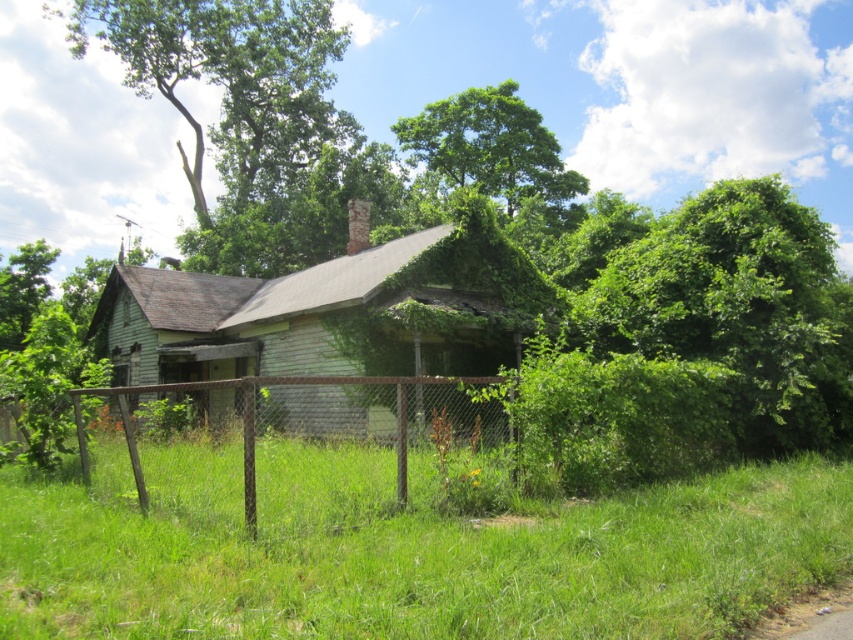
Question: Can you confirm if green grass at lower center is positioned to the left of green leafy tree at upper right?

Choices:
 (A) yes
 (B) no

Answer: (A)

Question: Is green leafy tree at upper center thinner than rusty chain-link fence at lower center?

Choices:
 (A) yes
 (B) no

Answer: (B)

Question: Which of these objects is positioned closest to the green grass at lower center?

Choices:
 (A) green leafy tree at upper left
 (B) rusty chain-link fence at lower center
 (C) green leafy tree at upper center

Answer: (B)

Question: Based on their relative distances, which object is nearer to the green leafy tree at upper right?

Choices:
 (A) rusty chain-link fence at lower center
 (B) green grass at lower center
 (C) green leafy tree at upper left

Answer: (A)

Question: Considering the real-world distances, which object is closest to the rusty chain-link fence at lower center?

Choices:
 (A) green leafy tree at upper right
 (B) green leafy tree at upper center
 (C) green leafy tree at upper left

Answer: (A)

Question: Does green leafy tree at upper center appear over rusty chain-link fence at lower center?

Choices:
 (A) yes
 (B) no

Answer: (A)